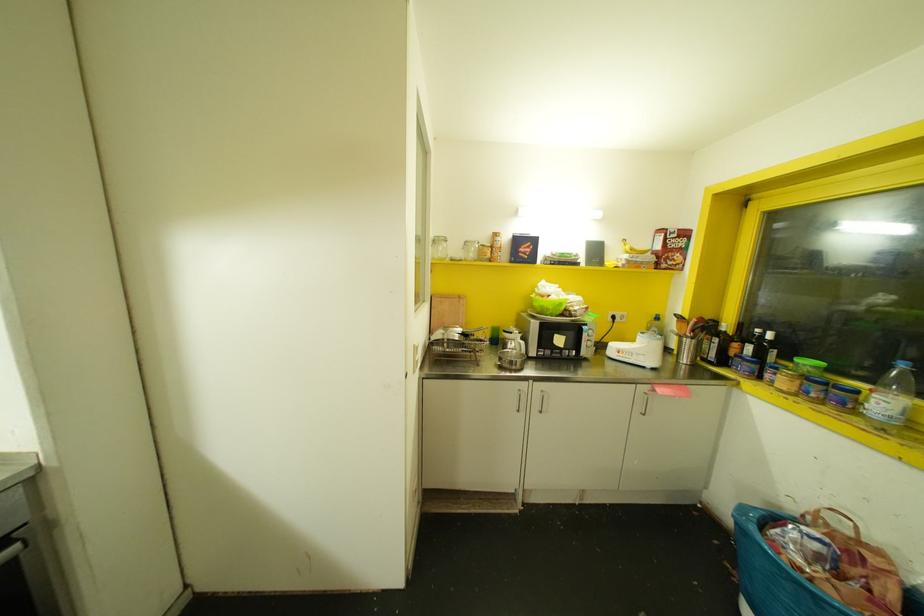
Describe the element at coordinates (546, 305) in the screenshot. Image resolution: width=924 pixels, height=616 pixels. I see `a green plastic bowl` at that location.